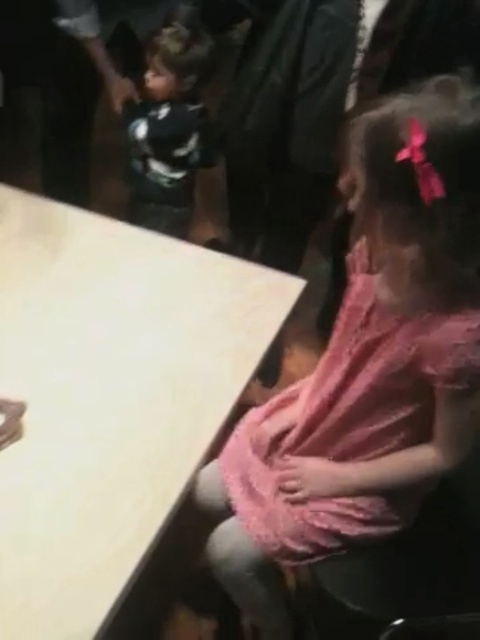
Question: Is white matte table at lower left behind pink lace dress at lower right?

Choices:
 (A) no
 (B) yes

Answer: (A)

Question: Is pink lace dress at lower right above black matte shirt at upper left?

Choices:
 (A) no
 (B) yes

Answer: (A)

Question: Is pink lace dress at lower right above black matte shirt at upper left?

Choices:
 (A) yes
 (B) no

Answer: (B)

Question: Which point is closer to the camera taking this photo?

Choices:
 (A) (349, 332)
 (B) (145, 214)

Answer: (A)

Question: Which object is closer to the camera taking this photo?

Choices:
 (A) black matte shirt at upper left
 (B) pink lace dress at lower right
 (C) white matte table at lower left

Answer: (C)

Question: Which object is the farthest from the black matte shirt at upper left?

Choices:
 (A) white matte table at lower left
 (B) pink lace dress at lower right

Answer: (B)